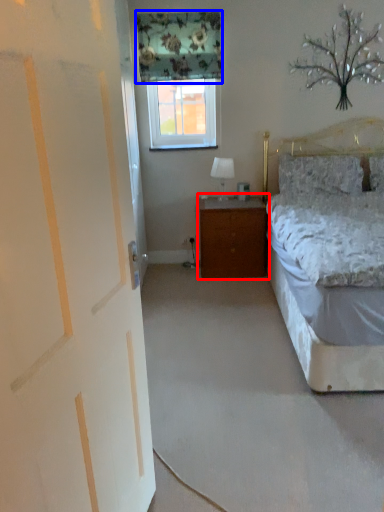
Question: Which object appears closest to the camera in this image, nightstand (highlighted by a red box) or curtain (highlighted by a blue box)?

Choices:
 (A) nightstand
 (B) curtain

Answer: (B)